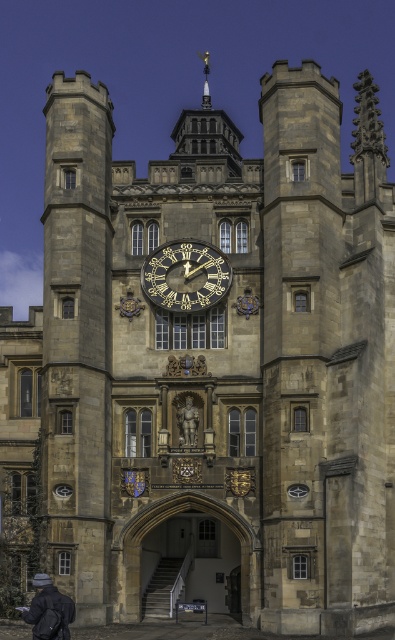
Question: Does gold metallic clock at center lie behind polished bronze statue at center?

Choices:
 (A) yes
 (B) no

Answer: (A)

Question: Among these objects, which one is nearest to the camera?

Choices:
 (A) gold metallic clock at center
 (B) polished bronze statue at center
 (C) dark gray knit hat at lower left

Answer: (C)

Question: Which object is closer to the camera taking this photo?

Choices:
 (A) dark gray knit hat at lower left
 (B) gold metallic clock at center

Answer: (A)

Question: Does gold metallic clock at center appear on the left side of polished bronze statue at center?

Choices:
 (A) no
 (B) yes

Answer: (B)

Question: Is dark gray knit hat at lower left to the left of polished bronze statue at center from the viewer's perspective?

Choices:
 (A) yes
 (B) no

Answer: (A)

Question: Which is nearer to the dark gray knit hat at lower left?

Choices:
 (A) polished bronze statue at center
 (B) gold metallic clock at center

Answer: (A)